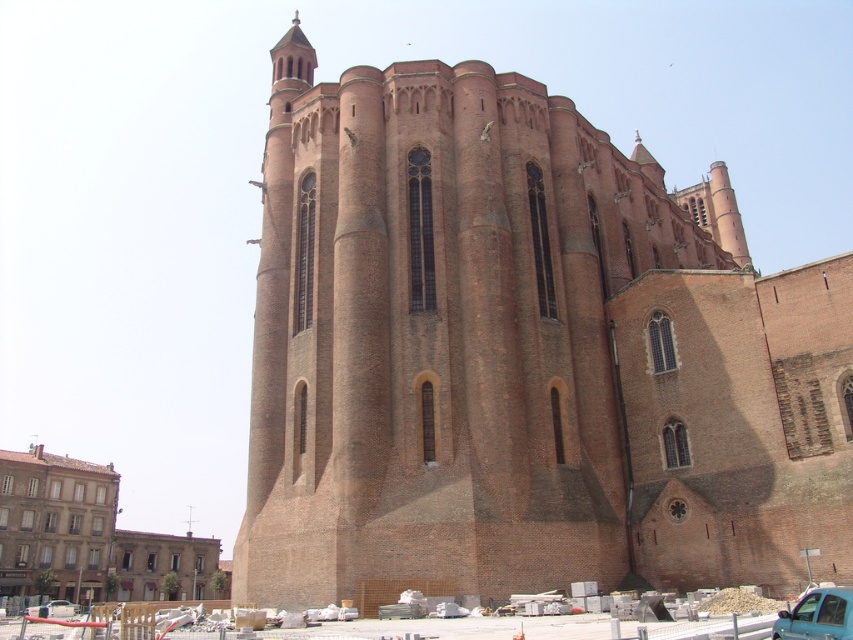
Who is more forward, (834, 611) or (45, 605)?

Positioned in front is point (834, 611).

Where is `teal matte car at lower right`? The height and width of the screenshot is (640, 853). teal matte car at lower right is located at coordinates (817, 616).

Find the location of `teal matte car at lower right`. teal matte car at lower right is located at coordinates (817, 616).

Is point (451, 202) closer to camera compared to point (781, 620)?

No, it is not.

Who is shorter, brick church at center or teal matte car at lower right?

With less height is teal matte car at lower right.

Is point (431, 236) behind point (828, 593)?

Yes, it is.

In order to click on brick church at center in this screenshot , I will do `click(521, 355)`.

Who is higher up, brick church at center or metallic silver car at lower left?

Positioned higher is brick church at center.

Looking at this image, is brick church at center thinner than metallic silver car at lower left?

No.

I want to click on brick church at center, so click(x=521, y=355).